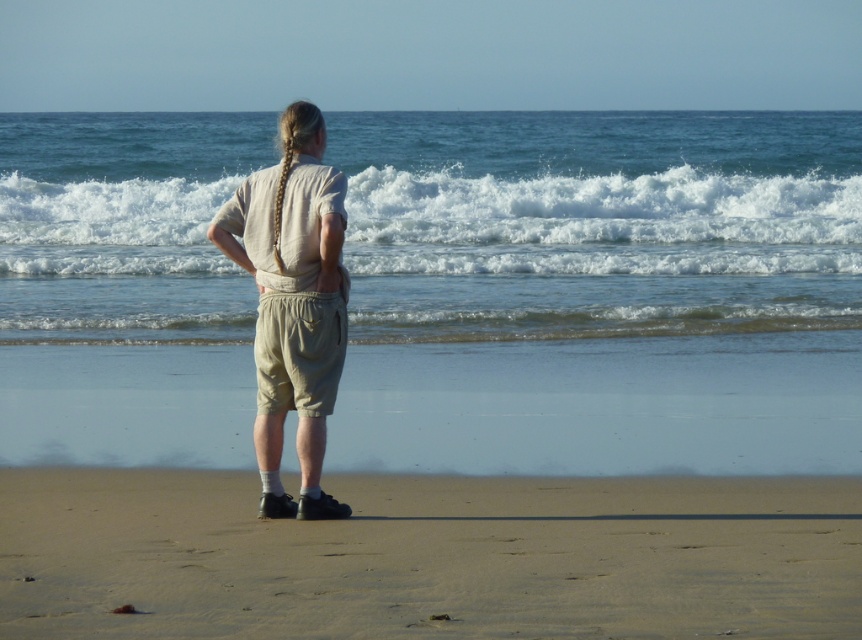
Is point (70, 243) more distant than point (307, 380)?

Yes, it is behind point (307, 380).

Does white frothy wave at upper center appear on the left side of beige cotton shorts at center?

Incorrect, white frothy wave at upper center is not on the left side of beige cotton shorts at center.

Between point (567, 269) and point (278, 433), which one is positioned behind?

Positioned behind is point (567, 269).

This screenshot has height=640, width=862. Find the location of `white frothy wave at upper center`. white frothy wave at upper center is located at coordinates (601, 224).

Find the location of a particular element. sandy beige at lower center is located at coordinates (429, 557).

Is sandy beige at lower center smaller than beige cotton shorts at center?

Yes, sandy beige at lower center is smaller than beige cotton shorts at center.

Image resolution: width=862 pixels, height=640 pixels. I want to click on sandy beige at lower center, so click(429, 557).

This screenshot has height=640, width=862. In order to click on sandy beige at lower center in this screenshot , I will do `click(429, 557)`.

Which is below, sandy beige at lower center or white frothy wave at upper center?

sandy beige at lower center

Is sandy beige at lower center above white frothy wave at upper center?

Actually, sandy beige at lower center is below white frothy wave at upper center.

Is point (8, 493) more distant than point (92, 269)?

No, (8, 493) is closer to viewer.

Image resolution: width=862 pixels, height=640 pixels. In order to click on sandy beige at lower center in this screenshot , I will do `click(429, 557)`.